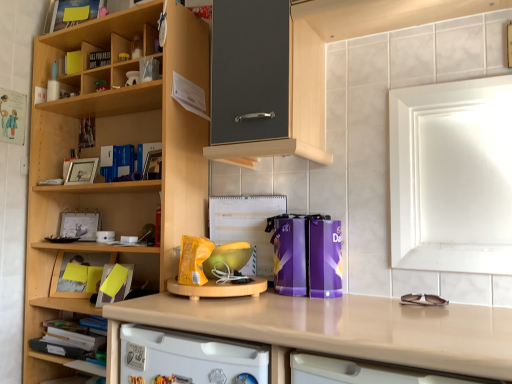
Question: Is wooden cupboard at left not near yellow paper at left?

Choices:
 (A) no
 (B) yes

Answer: (A)

Question: Is wooden cupboard at left in contact with yellow paper at left?

Choices:
 (A) yes
 (B) no

Answer: (B)

Question: Does wooden cupboard at left appear on the left side of yellow paper at left?

Choices:
 (A) no
 (B) yes

Answer: (A)

Question: Is wooden cupboard at left outside of yellow paper at left?

Choices:
 (A) yes
 (B) no

Answer: (A)

Question: Is wooden cupboard at left positioned behind yellow paper at left?

Choices:
 (A) yes
 (B) no

Answer: (B)

Question: From the image's perspective, is wooden cupboard at left on top of yellow paper at left?

Choices:
 (A) yes
 (B) no

Answer: (A)

Question: Does white glossy dishwasher at lower center appear on the left side of matte black photo frame at upper left, the 1th book in the back-to-front sequence?

Choices:
 (A) yes
 (B) no

Answer: (B)

Question: From a real-world perspective, is white glossy dishwasher at lower center over matte black photo frame at upper left, which ranks as the fourth book in front-to-back order?

Choices:
 (A) no
 (B) yes

Answer: (A)

Question: Is white glossy dishwasher at lower center oriented towards matte black photo frame at upper left, which appears as the second book when ordered from the bottom?

Choices:
 (A) yes
 (B) no

Answer: (B)

Question: Considering the relative sizes of white glossy dishwasher at lower center and matte black photo frame at upper left, the 1th book in the back-to-front sequence, in the image provided, is white glossy dishwasher at lower center wider than matte black photo frame at upper left, the 1th book in the back-to-front sequence,?

Choices:
 (A) no
 (B) yes

Answer: (B)

Question: From the image's perspective, is white glossy dishwasher at lower center located above matte black photo frame at upper left, which appears as the second book when ordered from the bottom?

Choices:
 (A) yes
 (B) no

Answer: (B)

Question: From a real-world perspective, is white glossy dishwasher at lower center physically below matte black photo frame at upper left, which ranks as the fourth book in front-to-back order?

Choices:
 (A) no
 (B) yes

Answer: (B)

Question: Is matte black photo frame at upper left, the 1th book in the back-to-front sequence, further to the viewer compared to yellow paper at left?

Choices:
 (A) no
 (B) yes

Answer: (B)